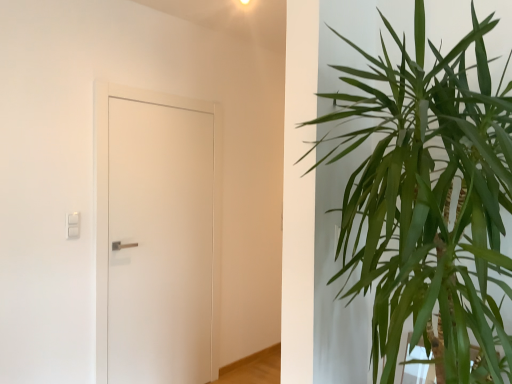
Question: Looking at the image, does white matte door at left seem bigger or smaller compared to green leafy plant at right?

Choices:
 (A) small
 (B) big

Answer: (A)

Question: From the image's perspective, is white matte door at left located above or below green leafy plant at right?

Choices:
 (A) below
 (B) above

Answer: (A)

Question: Would you say white matte door at left is to the left or to the right of green leafy plant at right in the picture?

Choices:
 (A) right
 (B) left

Answer: (B)

Question: Considering the positions of green leafy plant at right and white matte door at left in the image, is green leafy plant at right wider or thinner than white matte door at left?

Choices:
 (A) thin
 (B) wide

Answer: (B)

Question: Based on their sizes in the image, would you say green leafy plant at right is bigger or smaller than white matte door at left?

Choices:
 (A) small
 (B) big

Answer: (B)

Question: Considering the positions of point (357, 223) and point (97, 254), is point (357, 223) closer or farther from the camera than point (97, 254)?

Choices:
 (A) farther
 (B) closer

Answer: (B)

Question: From the image's perspective, is green leafy plant at right above or below white matte door at left?

Choices:
 (A) below
 (B) above

Answer: (B)